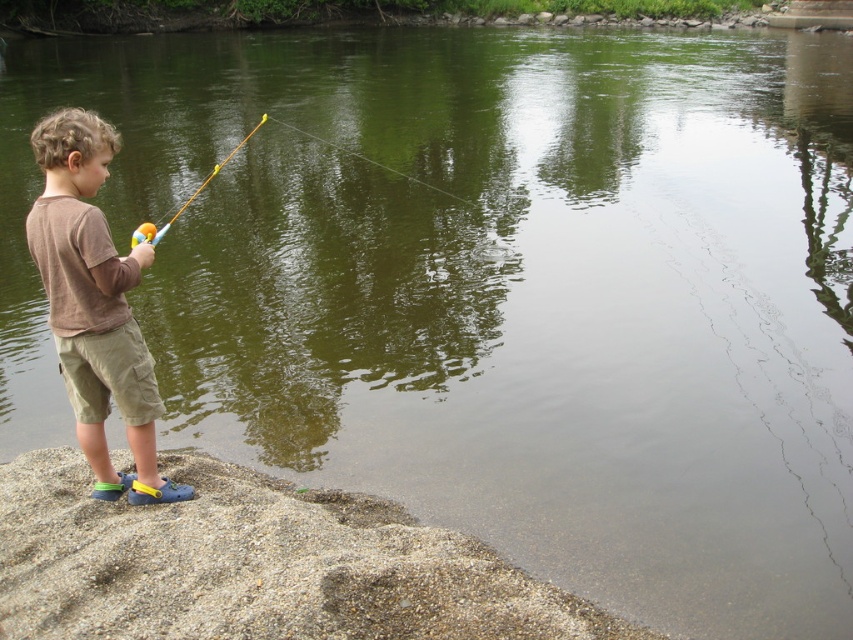
Question: Which point is farther to the camera?

Choices:
 (A) brown gravel at lower left
 (B) brown cotton shirt at left

Answer: (B)

Question: Is brown cotton shirt at left thinner than transparent plastic fishing line at center?

Choices:
 (A) no
 (B) yes

Answer: (B)

Question: Does brown cotton shirt at left lie behind transparent plastic fishing line at center?

Choices:
 (A) no
 (B) yes

Answer: (A)

Question: Can you confirm if brown cotton shirt at left is positioned to the left of transparent plastic fishing line at center?

Choices:
 (A) yes
 (B) no

Answer: (B)

Question: Which point is closer to the camera?

Choices:
 (A) brown gravel at lower left
 (B) blue plastic fishing pole at left
 (C) brown cotton shirt at left
 (D) transparent plastic fishing line at center

Answer: (A)

Question: Based on their relative distances, which object is nearer to the transparent plastic fishing line at center?

Choices:
 (A) brown gravel at lower left
 (B) blue plastic fishing pole at left

Answer: (B)